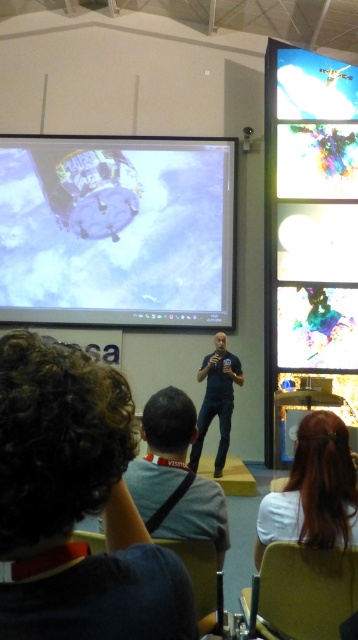
Question: Which of the following is the farthest from the observer?

Choices:
 (A) smooth brown hair at lower right
 (B) blue denim jeans at center
 (C) shiny metallic display at right
 (D) metallic spacecraft at upper left

Answer: (D)

Question: Considering the relative positions of shiny metallic display at right and transparent plastic screen at upper right in the image provided, where is shiny metallic display at right located with respect to transparent plastic screen at upper right?

Choices:
 (A) right
 (B) left

Answer: (B)

Question: Which point is closer to the camera?

Choices:
 (A) (113, 234)
 (B) (287, 84)

Answer: (B)

Question: Does smooth brown hair at lower right have a smaller size compared to blue denim jeans at center?

Choices:
 (A) yes
 (B) no

Answer: (A)

Question: Based on their relative distances, which object is farther from the smooth brown hair at lower right?

Choices:
 (A) shiny metallic display at right
 (B) blue denim jeans at center
 (C) metallic spacecraft at upper left
 (D) transparent plastic screen at upper right

Answer: (C)

Question: Can you confirm if smooth brown hair at lower right is bigger than transparent plastic screen at upper right?

Choices:
 (A) no
 (B) yes

Answer: (A)